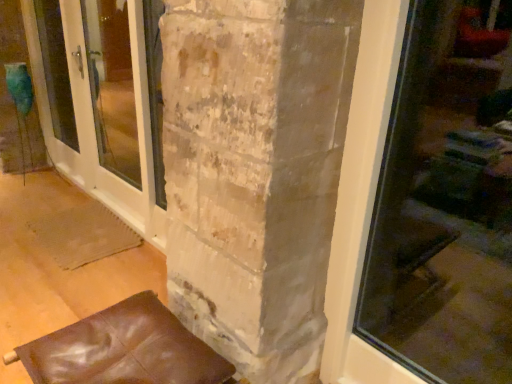
At what (x,y) coordinates should I click in order to perform the action: click on white glossy screen door at left. Please return your answer as a coordinate pair (x, y). The height and width of the screenshot is (384, 512). Looking at the image, I should click on (103, 107).

Image resolution: width=512 pixels, height=384 pixels. Describe the element at coordinates (103, 107) in the screenshot. I see `white glossy screen door at left` at that location.

What do you see at coordinates (123, 349) in the screenshot?
I see `leather cushion at lower left` at bounding box center [123, 349].

Find the location of a particular element. leather cushion at lower left is located at coordinates (123, 349).

You are a GUI agent. You are given a task and a screenshot of the screen. Output one action in this format:
    pyautogui.click(x=<x>, y=<y>)
    Task: Click on the white glossy screen door at left
    The image size is (512, 384).
    Given the screenshot: What is the action you would take?
    pyautogui.click(x=103, y=107)

Which object is positioned more to the right, white glossy screen door at left or leather cushion at lower left?

leather cushion at lower left.

Is the depth of white glossy screen door at left less than that of leather cushion at lower left?

No, white glossy screen door at left is behind leather cushion at lower left.

Which is behind, point (84, 88) or point (95, 361)?

The point (84, 88) is behind.

From the image's perspective, is white glossy screen door at left over leather cushion at lower left?

Yes, from the image's perspective, white glossy screen door at left is on top of leather cushion at lower left.

From a real-world perspective, relative to leather cushion at lower left, is white glossy screen door at left vertically above or below?

In terms of real-world spatial position, white glossy screen door at left is above leather cushion at lower left.

Looking at this image, is white glossy screen door at left thinner than leather cushion at lower left?

Yes, white glossy screen door at left is thinner than leather cushion at lower left.

In terms of height, does white glossy screen door at left look taller or shorter compared to leather cushion at lower left?

Considering their sizes, white glossy screen door at left has more height than leather cushion at lower left.

Considering the sizes of white glossy screen door at left and leather cushion at lower left in the image, is white glossy screen door at left bigger or smaller than leather cushion at lower left?

Considering their sizes, white glossy screen door at left takes up more space than leather cushion at lower left.

Is leather cushion at lower left located within white glossy screen door at left?

No.

Is white glossy screen door at left positioned far away from leather cushion at lower left?

Yes, white glossy screen door at left is far from leather cushion at lower left.

Consider the image. Is white glossy screen door at left turned away from leather cushion at lower left?

No.

Looking at this image, how different are the orientations of white glossy screen door at left and leather cushion at lower left in degrees?

white glossy screen door at left and leather cushion at lower left are facing 0.693 degrees away from each other.

How much distance is there between white glossy screen door at left and leather cushion at lower left?

A distance of 3.36 feet exists between white glossy screen door at left and leather cushion at lower left.

Where is `screen door on the left of the leather cushion at lower left`? This screenshot has width=512, height=384. screen door on the left of the leather cushion at lower left is located at coordinates (103, 107).

Visually, is leather cushion at lower left positioned to the left or to the right of white glossy screen door at left?

leather cushion at lower left is positioned on white glossy screen door at left's right side.

Does leather cushion at lower left come behind white glossy screen door at left?

That is False.

Does point (159, 383) appear closer or farther from the camera than point (80, 172)?

Point (159, 383).

From the image's perspective, is leather cushion at lower left on top of white glossy screen door at left?

Actually, leather cushion at lower left appears below white glossy screen door at left in the image.

From a real-world perspective, relative to white glossy screen door at left, is leather cushion at lower left vertically above or below?

Clearly, from a real-world perspective, leather cushion at lower left is below white glossy screen door at left.

Does leather cushion at lower left have a lesser width compared to white glossy screen door at left?

No.

From their relative heights in the image, would you say leather cushion at lower left is taller or shorter than white glossy screen door at left?

leather cushion at lower left is shorter than white glossy screen door at left.

Is leather cushion at lower left smaller than white glossy screen door at left?

Yes.

Is white glossy screen door at left a part of leather cushion at lower left?

No, white glossy screen door at left is not inside leather cushion at lower left.

Is leather cushion at lower left not near white glossy screen door at left?

leather cushion at lower left is positioned a significant distance from white glossy screen door at left.

Is white glossy screen door at left at the back of leather cushion at lower left?

No.

How different are the orientations of leather cushion at lower left and white glossy screen door at left in degrees?

The angular difference between leather cushion at lower left and white glossy screen door at left is 0.693 degrees.

This screenshot has height=384, width=512. I want to click on furniture lying in front of the white glossy screen door at left, so click(123, 349).

The width and height of the screenshot is (512, 384). I want to click on furniture in front of the white glossy screen door at left, so click(x=123, y=349).

Find the location of a particular element. furniture that is below the white glossy screen door at left (from the image's perspective) is located at coordinates (123, 349).